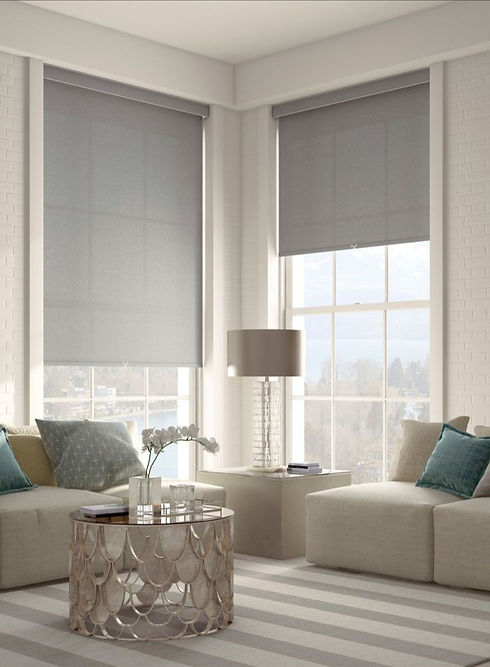
The width and height of the screenshot is (490, 667). Identify the location of pillows. (452, 468), (412, 459).